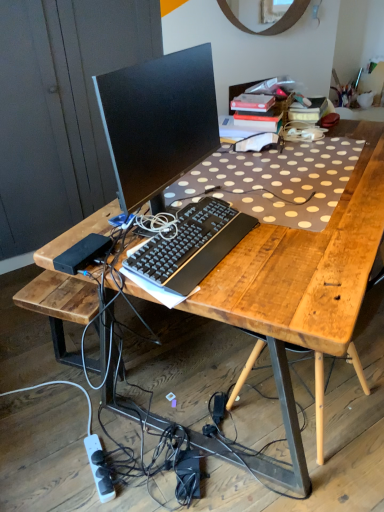
The image size is (384, 512). In order to click on free spot to the left of wooden at right in this screenshot , I will do `click(182, 406)`.